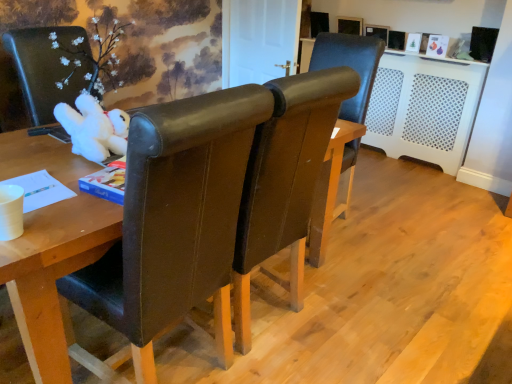
You are a GUI agent. You are given a task and a screenshot of the screen. Output one action in this format:
    pyautogui.click(x=<x>, y=<y>)
    Task: Click on the vacant area located to the right-hand side of brown leather chair at center, the third chair positioned from the front
    Image resolution: width=512 pixels, height=384 pixels.
    Given the screenshot: What is the action you would take?
    pyautogui.click(x=389, y=220)